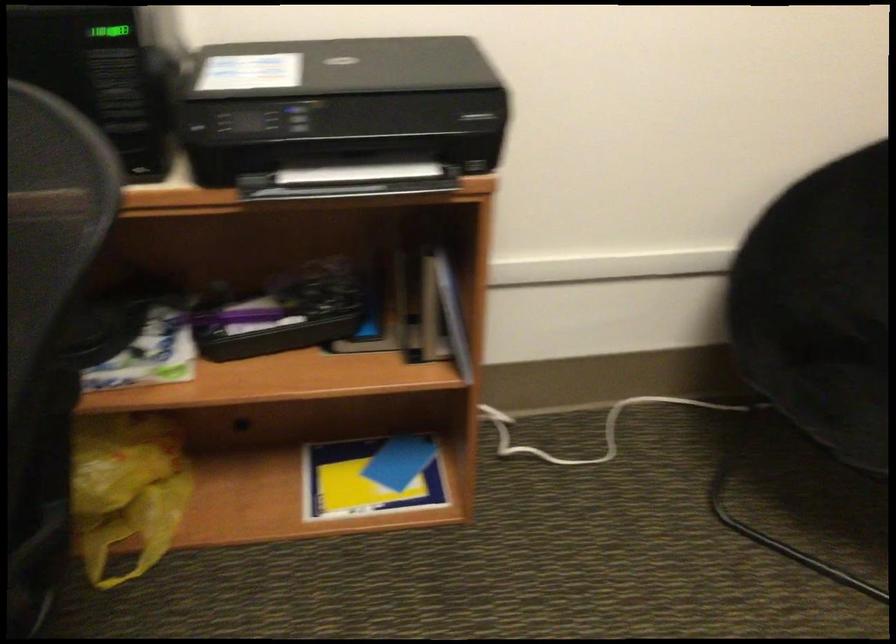
Where is `printer paper tray`? The image size is (896, 644). printer paper tray is located at coordinates (357, 174).